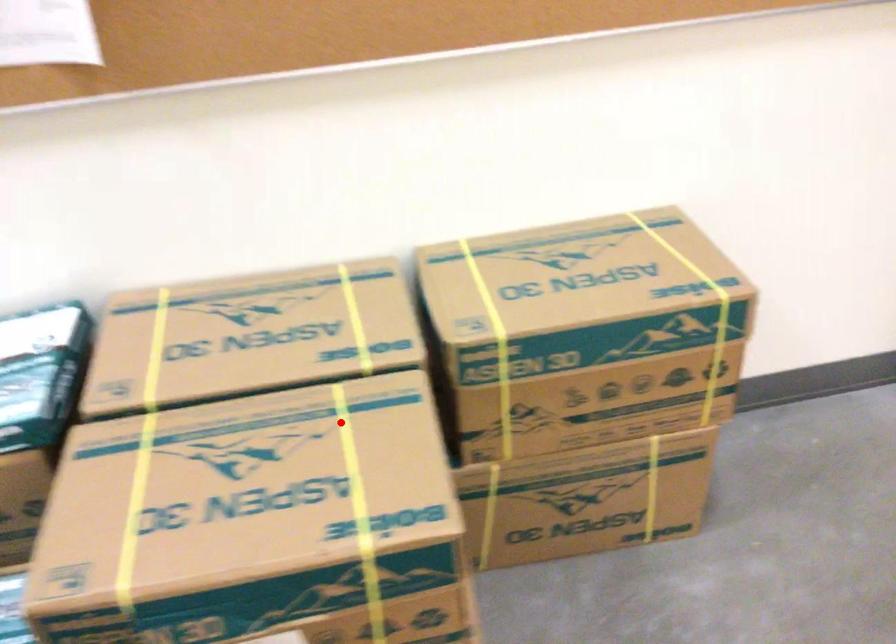
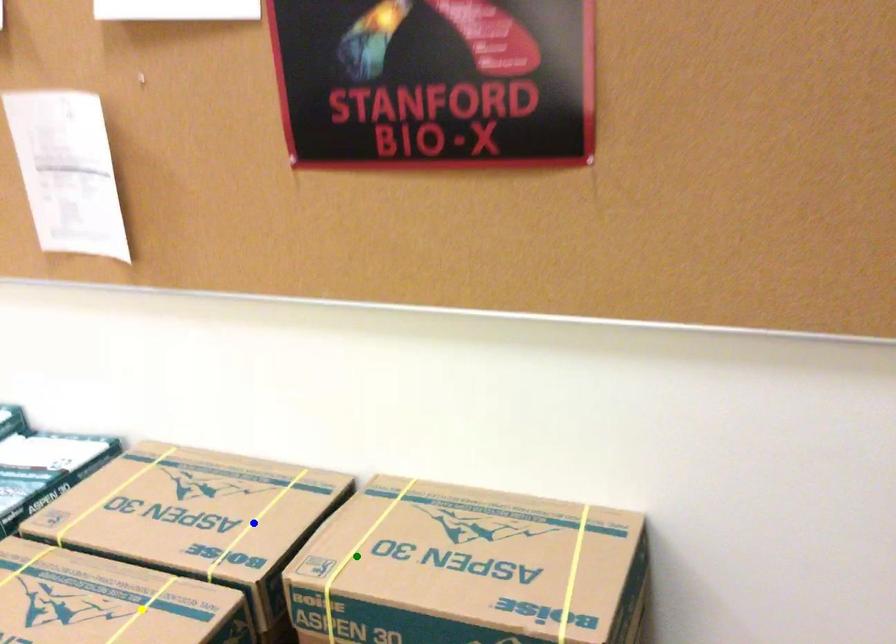
Question: I am providing you with two images of the same scene from different viewpoints. A red point is marked on the first image. You are given multiple points on the second image. Can you choose the point in image 2 that corresponds to the point in image 1?

Choices:
 (A) blue point
 (B) green point
 (C) yellow point

Answer: (C)